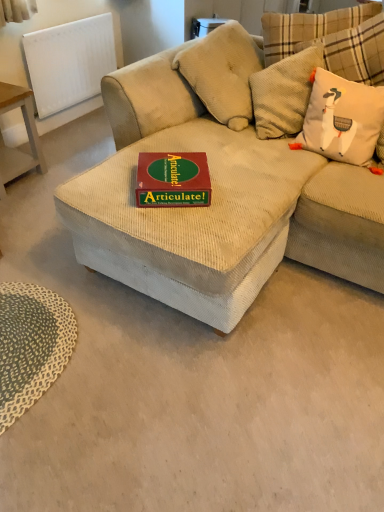
Question: Is green textured mat at lower left spatially inside green matte board game at center, or outside of it?

Choices:
 (A) outside
 (B) inside

Answer: (A)

Question: From a real-world perspective, is green textured mat at lower left positioned above or below green matte board game at center?

Choices:
 (A) below
 (B) above

Answer: (A)

Question: Which of these objects is positioned farthest from the beige corduroy couch at center?

Choices:
 (A) green matte board game at center
 (B) white corduroy throw pillow at upper right
 (C) white textured radiator at upper left
 (D) wooden table at left
 (E) green textured mat at lower left

Answer: (C)

Question: Considering the real-world distances, which object is closest to the green textured mat at lower left?

Choices:
 (A) white textured radiator at upper left
 (B) beige corduroy couch at center
 (C) green matte board game at center
 (D) wooden table at left
 (E) white corduroy throw pillow at upper right

Answer: (C)